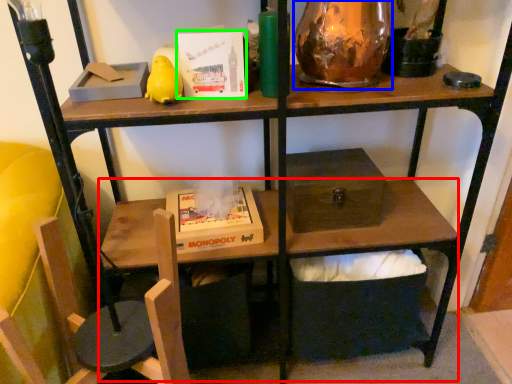
Question: Considering the real-world distances, which object is closest to computer desk (highlighted by a red box)? glass vase (highlighted by a blue box) or paperback book (highlighted by a green box).

Choices:
 (A) glass vase
 (B) paperback book

Answer: (A)